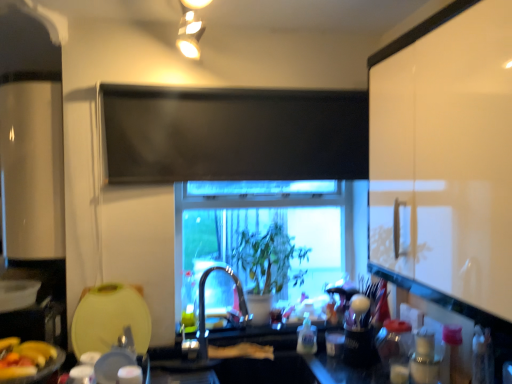
The height and width of the screenshot is (384, 512). I want to click on green matte plant at center, so click(x=270, y=259).

The height and width of the screenshot is (384, 512). I want to click on translucent plastic bottle at right, the 1th bottle in the front-to-back sequence, so click(x=425, y=358).

Where is `white glossy cabinet at right`? The width and height of the screenshot is (512, 384). white glossy cabinet at right is located at coordinates (446, 155).

Identify the location of translucent plastic bottle at center, the 1th bottle from the left. (307, 337).

The image size is (512, 384). Find the location of `transparent glass window at center`. transparent glass window at center is located at coordinates (271, 240).

You are a GUI agent. You are given a task and a screenshot of the screen. Output one action in this format:
    pyautogui.click(x=<x>, y=<y>)
    Task: Click on the satin nickel faucet at center
    The width and height of the screenshot is (512, 384).
    Given the screenshot: What is the action you would take?
    pyautogui.click(x=204, y=304)

The height and width of the screenshot is (384, 512). What do you see at coordinates (359, 333) in the screenshot?
I see `matte plastic toothbrush holder at lower right` at bounding box center [359, 333].

What is the approximate width of matte plastic toothbrush holder at lower right?

It is 13.55 centimeters.

The image size is (512, 384). Find the location of `green matte plant at center`. green matte plant at center is located at coordinates (270, 259).

Considering the relative positions of transparent glass window at center and matte gold light fixture at upper center in the image provided, is transparent glass window at center to the left of matte gold light fixture at upper center from the viewer's perspective?

No.

From the image's perspective, is transparent glass window at center beneath matte gold light fixture at upper center?

Yes.

This screenshot has width=512, height=384. Identify the location of window below the matte gold light fixture at upper center (from a real-world perspective). (271, 240).

Between transparent glass window at center and matte gold light fixture at upper center, which one has smaller width?

Thinner between the two is transparent glass window at center.

In the scene shown: From the image's perspective, relative to green matte plant at center, is translucent plastic bottle at right, which ranks as the 2th bottle in left-to-right order, above or below?

A: Based on their image positions, translucent plastic bottle at right, which ranks as the 2th bottle in left-to-right order, is located beneath green matte plant at center.

From a real-world perspective, who is located lower, translucent plastic bottle at right, which is the 1th bottle in right-to-left order, or green matte plant at center?

translucent plastic bottle at right, which is the 1th bottle in right-to-left order, is physically lower.

Can you confirm if translucent plastic bottle at right, marked as the second bottle in a back-to-front arrangement, is wider than green matte plant at center?

No.

Which is in front, translucent plastic bottle at right, which is the 1th bottle in right-to-left order, or green matte plant at center?

translucent plastic bottle at right, which is the 1th bottle in right-to-left order, is more forward.

Who is more distant, matte gold light fixture at upper center or yellow matte bananas at lower left?

yellow matte bananas at lower left is further away from the camera.

From a real-world perspective, which is physically below, matte gold light fixture at upper center or yellow matte bananas at lower left?

yellow matte bananas at lower left is physically lower.

Can you confirm if matte gold light fixture at upper center is smaller than yellow matte bananas at lower left?

Incorrect, matte gold light fixture at upper center is not smaller in size than yellow matte bananas at lower left.

Which of these two, transparent glass window at center or translucent plastic bottle at center, the 2th bottle when ordered from front to back, is wider?

Wider between the two is transparent glass window at center.

Could you tell me if transparent glass window at center is turned towards translucent plastic bottle at center, which is the first bottle from back to front?

Yes, transparent glass window at center is oriented towards translucent plastic bottle at center, which is the first bottle from back to front.

Is transparent glass window at center closer to the viewer compared to translucent plastic bottle at center, the 1th bottle from the left?

No, transparent glass window at center is behind translucent plastic bottle at center, the 1th bottle from the left.

Considering the positions of point (248, 197) and point (315, 332), is point (248, 197) closer or farther from the camera than point (315, 332)?

Point (248, 197) is positioned farther from the camera compared to point (315, 332).

Does translucent plastic bottle at right, the 1th bottle in the front-to-back sequence, touch white glossy cabinet at right?

No, translucent plastic bottle at right, the 1th bottle in the front-to-back sequence, is not beside white glossy cabinet at right.

How many degrees apart are the facing directions of translucent plastic bottle at right, the 1th bottle in the front-to-back sequence, and white glossy cabinet at right?

0.837 degrees.

Does translucent plastic bottle at right, marked as the second bottle in a back-to-front arrangement, have a greater height compared to white glossy cabinet at right?

No, translucent plastic bottle at right, marked as the second bottle in a back-to-front arrangement, is not taller than white glossy cabinet at right.

Between translucent plastic bottle at right, the 1th bottle in the front-to-back sequence, and white glossy cabinet at right, which one has smaller width?

translucent plastic bottle at right, the 1th bottle in the front-to-back sequence, is thinner.

Is matte gold light fixture at upper center facing away from white glossy cabinet at right?

That's not correct — matte gold light fixture at upper center is not looking away from white glossy cabinet at right.

Measure the distance between matte gold light fixture at upper center and white glossy cabinet at right.

The distance of matte gold light fixture at upper center from white glossy cabinet at right is 1.06 meters.

From their relative heights in the image, would you say matte gold light fixture at upper center is taller or shorter than white glossy cabinet at right?

Clearly, matte gold light fixture at upper center is shorter compared to white glossy cabinet at right.

From a real-world perspective, which is physically below, matte gold light fixture at upper center or white glossy cabinet at right?

white glossy cabinet at right is physically lower.

Is matte plastic toothbrush holder at lower right bigger than green matte plant at center?

Actually, matte plastic toothbrush holder at lower right might be smaller than green matte plant at center.

Which object is closer to the camera taking this photo, matte plastic toothbrush holder at lower right or green matte plant at center?

matte plastic toothbrush holder at lower right is closer to the camera.

In terms of height, does matte plastic toothbrush holder at lower right look taller or shorter compared to green matte plant at center?

matte plastic toothbrush holder at lower right is shorter than green matte plant at center.

You are a GUI agent. You are given a task and a screenshot of the screen. Output one action in this format:
    pyautogui.click(x=<x>, y=<y>)
    Task: Click on the light fixture that is above the transparent glass window at center (from a real-world perspective)
    
    Given the screenshot: What is the action you would take?
    pyautogui.click(x=190, y=28)

Identify the location of the 1st bottle below the green matte plant at center (from the image's perspective). The height and width of the screenshot is (384, 512). (425, 358).

When comparing their distances from matte gold light fixture at upper center, does translucent plastic bottle at center, the 2th bottle when ordered from front to back, or white glossy cabinet at right seem further?

Among the two, translucent plastic bottle at center, the 2th bottle when ordered from front to back, is located further to matte gold light fixture at upper center.

Based on their spatial positions, is transparent glass window at center or translucent plastic bottle at center, which is the first bottle from back to front, further from matte gold light fixture at upper center?

translucent plastic bottle at center, which is the first bottle from back to front, is positioned further to the anchor matte gold light fixture at upper center.

Based on their spatial positions, is matte plastic toothbrush holder at lower right or translucent plastic bottle at right, which ranks as the 2th bottle in left-to-right order, closer to yellow matte bananas at lower left?

matte plastic toothbrush holder at lower right.

Based on their spatial positions, is satin nickel faucet at center or white glossy cabinet at right further from yellow matte bananas at lower left?

white glossy cabinet at right lies further to yellow matte bananas at lower left than the other object.

Which object lies nearer to the anchor point translucent plastic bottle at center, which is the first bottle from back to front, yellow matte bananas at lower left or matte plastic toothbrush holder at lower right?

matte plastic toothbrush holder at lower right is closer to translucent plastic bottle at center, which is the first bottle from back to front.

Estimate the real-world distances between objects in this image. Which object is further from green matte plant at center, white glossy cabinet at right or transparent glass window at center?

The object further to green matte plant at center is white glossy cabinet at right.

Looking at the image, which one is located closer to satin nickel faucet at center, green matte plant at center or matte gold light fixture at upper center?

green matte plant at center.

From the image, which object appears to be farther from translucent plastic bottle at center, the 2th bottle when ordered from front to back, yellow matte bananas at lower left or translucent plastic bottle at right, the 1th bottle in the front-to-back sequence?

The object further to translucent plastic bottle at center, the 2th bottle when ordered from front to back, is yellow matte bananas at lower left.

The width and height of the screenshot is (512, 384). I want to click on light fixture between yellow matte bananas at lower left and translucent plastic bottle at right, marked as the second bottle in a back-to-front arrangement, from left to right, so click(190, 28).

Identify the location of faucet between yellow matte bananas at lower left and green matte plant at center in the horizontal direction. (204, 304).

You are a GUI agent. You are given a task and a screenshot of the screen. Output one action in this format:
    pyautogui.click(x=<x>, y=<y>)
    Task: Click on the faucet between matte gold light fixture at upper center and matte plastic toothbrush holder at lower right vertically
    The height and width of the screenshot is (384, 512).
    Given the screenshot: What is the action you would take?
    pyautogui.click(x=204, y=304)

Locate an element on the screen. This screenshot has width=512, height=384. bottle positioned between white glossy cabinet at right and translucent plastic bottle at center, the 2th bottle in the right-to-left sequence, from near to far is located at coordinates (425, 358).